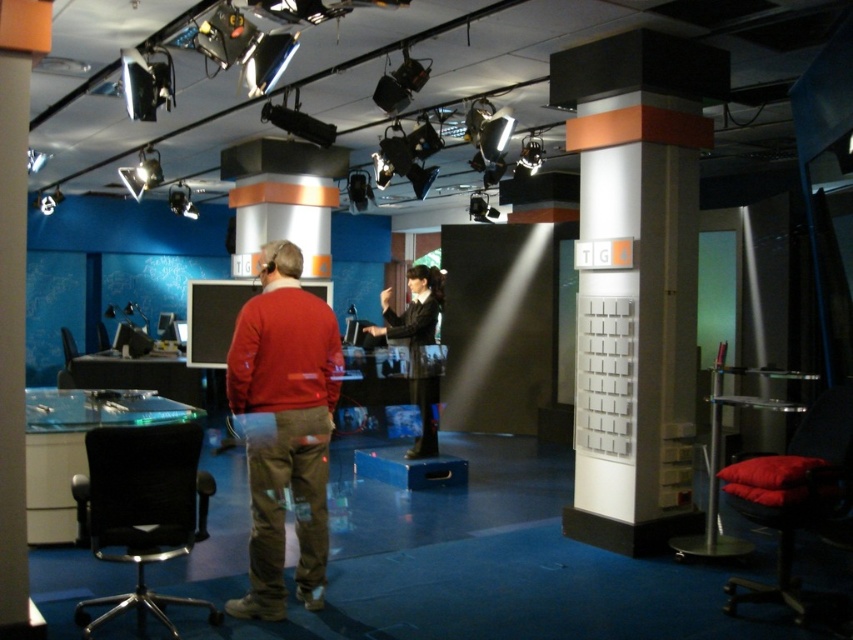
Question: Can you confirm if black mesh swivel chair at lower left is smaller than black glossy suit at center?

Choices:
 (A) yes
 (B) no

Answer: (A)

Question: Observing the image, what is the correct spatial positioning of white plastic pillar at center in reference to black mesh swivel chair at lower left?

Choices:
 (A) below
 (B) above

Answer: (B)

Question: Based on their relative distances, which object is nearer to the matte red sweater at center?

Choices:
 (A) black glossy suit at center
 (B) black mesh swivel chair at lower left

Answer: (B)

Question: Which of the following is the farthest from the observer?

Choices:
 (A) (380, 296)
 (B) (643, 500)
 (C) (281, 305)
 (D) (210, 621)

Answer: (A)

Question: Which object is the closest to the white plastic pillar at center?

Choices:
 (A) black glossy suit at center
 (B) matte red sweater at center

Answer: (A)

Question: Is white plastic pillar at center in front of black mesh swivel chair at lower left?

Choices:
 (A) yes
 (B) no

Answer: (B)